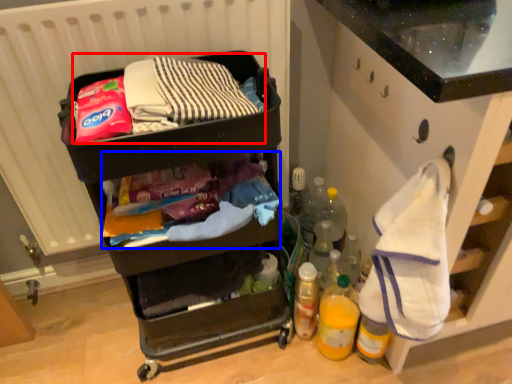
Question: Which object appears closest to the camera in this image, waste (highlighted by a red box) or waste (highlighted by a blue box)?

Choices:
 (A) waste
 (B) waste

Answer: (A)